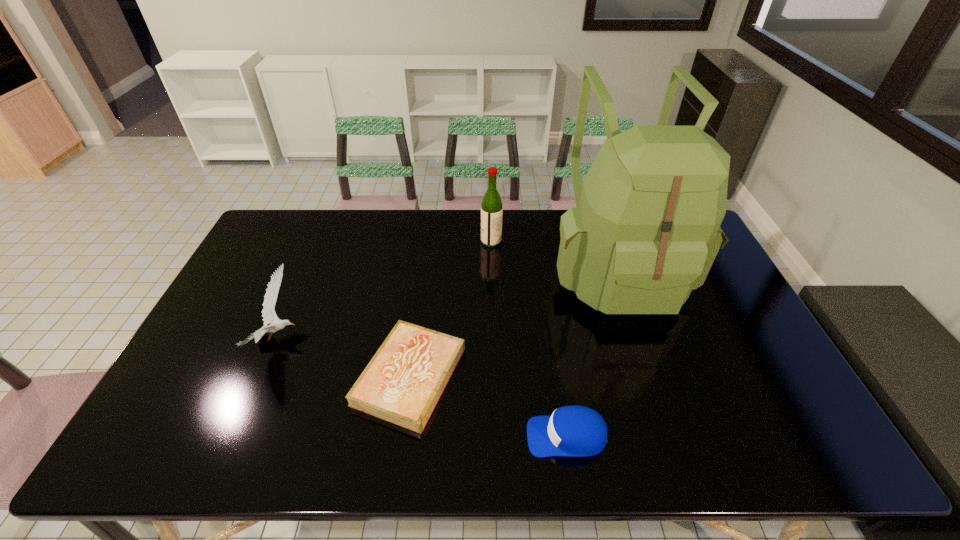
Where is `backpack`? backpack is located at coordinates (645, 232).

Locate an element on the screen. the third object from right to left is located at coordinates (491, 206).

You are a GUI agent. You are given a task and a screenshot of the screen. Output one action in this format:
    pyautogui.click(x=<x>, y=<y>)
    Task: Click on the second tallest object
    This screenshot has height=540, width=960.
    Given the screenshot: What is the action you would take?
    pyautogui.click(x=491, y=206)

At what (x,y) coordinates should I click in order to perform the action: click on the leftmost object. Please return your answer as a coordinate pair (x, y). Image resolution: width=960 pixels, height=540 pixels. Looking at the image, I should click on (269, 315).

This screenshot has width=960, height=540. Identify the location of the third shortest object. (269, 315).

Where is `baseball cap`? baseball cap is located at coordinates (575, 431).

Locate an element on the screen. the second object from left to right is located at coordinates (402, 383).

Find the location of a particular element. the shortest object is located at coordinates (402, 383).

This screenshot has width=960, height=540. Identify the location of free space located 0.080m on the front pocket of the tallest object. (645, 354).

Find the location of a particular element. free space located on the label of the liquor is located at coordinates (425, 241).